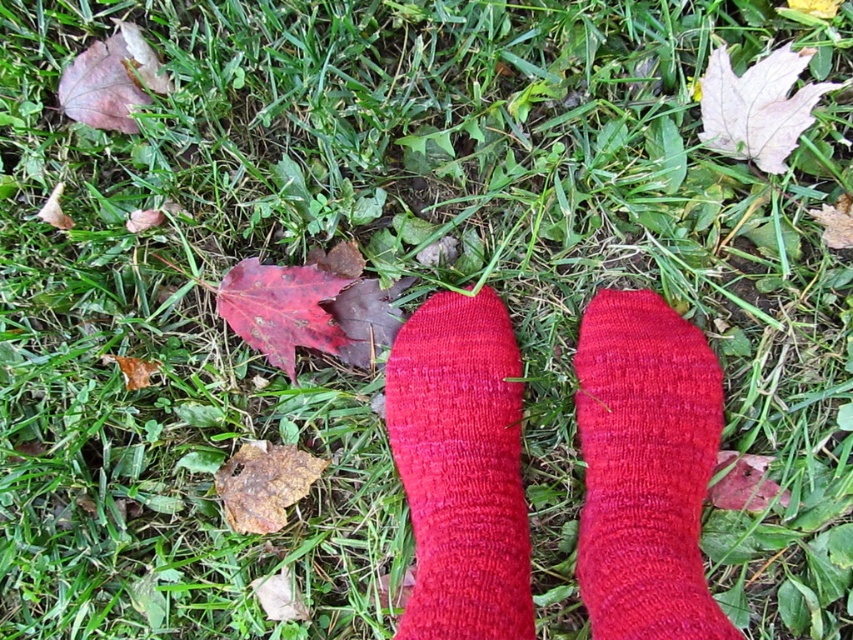
Is point (596, 576) closer to camera compared to point (500, 305)?

Yes, it is in front of point (500, 305).

Is knitted red sock at center smaller than matte red sock at center?

Indeed, knitted red sock at center has a smaller size compared to matte red sock at center.

Does point (664, 545) come in front of point (456, 356)?

Yes, it is.

Where is `knitted red sock at center`? The image size is (853, 640). knitted red sock at center is located at coordinates (645, 468).